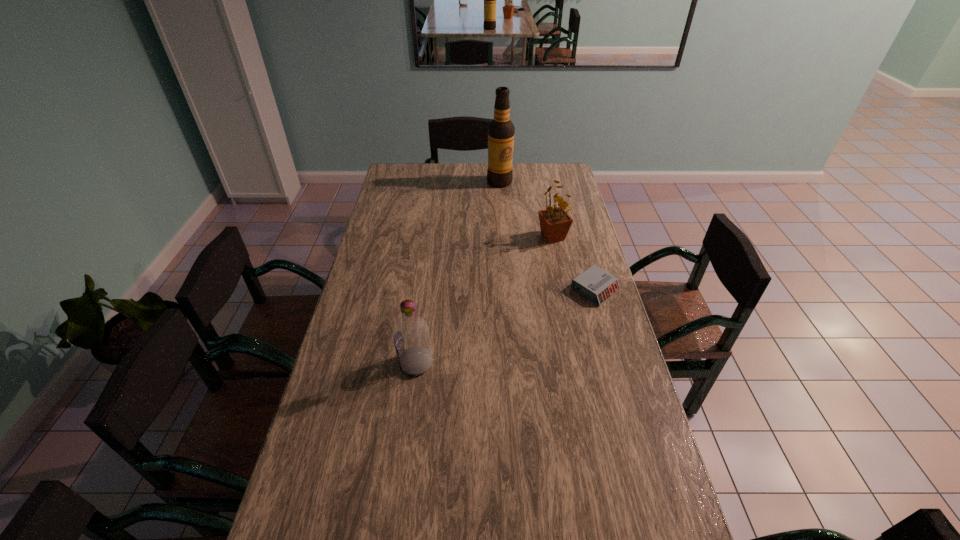
The height and width of the screenshot is (540, 960). What are the coordinates of `vodka` in the screenshot? It's located at (412, 340).

This screenshot has height=540, width=960. In order to click on the nearest object in this screenshot , I will do `click(412, 340)`.

At what (x,y) coordinates should I click in order to perform the action: click on the third farthest object. Please return your answer as a coordinate pair (x, y). The width and height of the screenshot is (960, 540). Looking at the image, I should click on (595, 284).

Locate an element on the screen. This screenshot has height=540, width=960. alarm clock is located at coordinates (595, 284).

Locate an element on the screen. alcohol is located at coordinates (501, 130).

Identify the location of the tallest object. The image size is (960, 540). (x=501, y=130).

Locate an element on the screen. the second farthest object is located at coordinates (555, 222).

The height and width of the screenshot is (540, 960). Find the location of `vacant position located 0.190m on the label of the vodka`. vacant position located 0.190m on the label of the vodka is located at coordinates (336, 363).

This screenshot has height=540, width=960. I want to click on vacant point located on the left of the shortest object, so click(495, 289).

Image resolution: width=960 pixels, height=540 pixels. Find the location of `free space located on the label of the alcohol`. free space located on the label of the alcohol is located at coordinates click(502, 197).